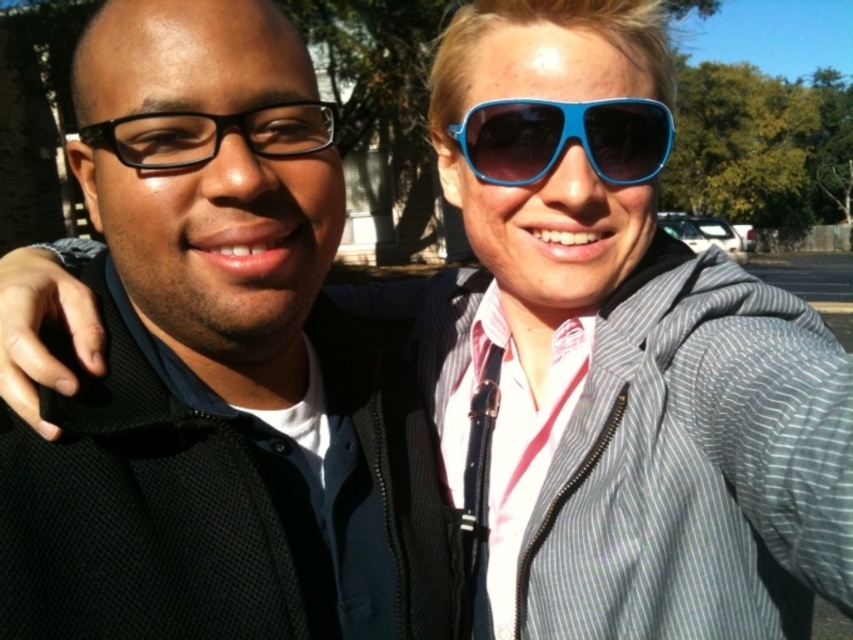
Question: Is black matte jacket at center to the right of blue plastic sunglasses at upper center from the viewer's perspective?

Choices:
 (A) yes
 (B) no

Answer: (B)

Question: Does black matte jacket at center have a smaller size compared to blue plastic sunglasses at upper center?

Choices:
 (A) yes
 (B) no

Answer: (B)

Question: Which of the following is the closest to the observer?

Choices:
 (A) (91, 145)
 (B) (556, 147)

Answer: (A)

Question: Is blue plastic sunglasses at upper center to the left of black plastic glasses at left from the viewer's perspective?

Choices:
 (A) yes
 (B) no

Answer: (B)

Question: Which of the following is the farthest from the observer?

Choices:
 (A) (288, 145)
 (B) (572, 120)

Answer: (B)

Question: Estimate the real-world distances between objects in this image. Which object is closer to the black matte jacket at center?

Choices:
 (A) blue plastic sunglasses at upper center
 (B) black plastic glasses at left

Answer: (B)